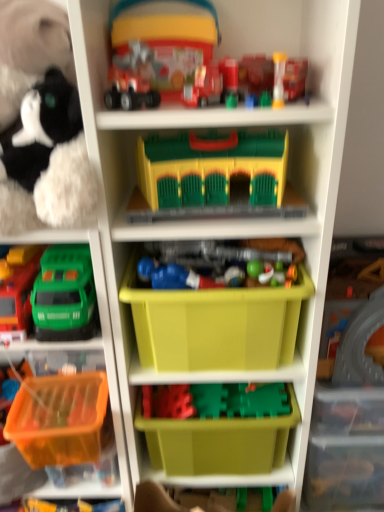
Question: Based on their sizes in the image, would you say translucent plastic toy at upper center, placed as the 2th toy when sorted from top to bottom, is bigger or smaller than green plastic storage box at lower center, which is the 2th storage box in bottom-to-top order?

Choices:
 (A) big
 (B) small

Answer: (B)

Question: From a real-world perspective, is translucent plastic toy at upper center, which is the eighth toy from bottom to top, positioned above or below green plastic storage box at lower center, which is the 2th storage box in bottom-to-top order?

Choices:
 (A) above
 (B) below

Answer: (A)

Question: Which of these objects is positioned closest to the translucent plastic cup at upper center, which is the fourth toy in top-to-bottom order?

Choices:
 (A) matte plastic toy truck at upper center, arranged as the 9th toy when ordered from the bottom
 (B) green plastic storage box at lower center, which is the 2th storage box in bottom-to-top order
 (C) blue plastic toy at center, the seventh toy viewed from the top
 (D) matte plastic toy car at upper center, which is counted as the 3th toy, starting from the top
 (E) green plastic toy truck at left, the 2th toy ordered from the bottom

Answer: (A)

Question: Estimate the real-world distances between objects in this image. Which object is closer to the matte plastic toy truck at upper center, which appears as the 1th toy when viewed from the top?

Choices:
 (A) green plastic storage box at lower center, which is the 2th storage box in bottom-to-top order
 (B) matte plastic train at center, placed as the 6th toy when sorted from top to bottom
 (C) translucent orange plastic container at lower left, positioned as the ninth toy in top-to-bottom order
 (D) translucent plastic toy at upper center, placed as the 2th toy when sorted from top to bottom
 (E) yellow plastic storage box at center, arranged as the third storage box when ordered from the bottom

Answer: (D)